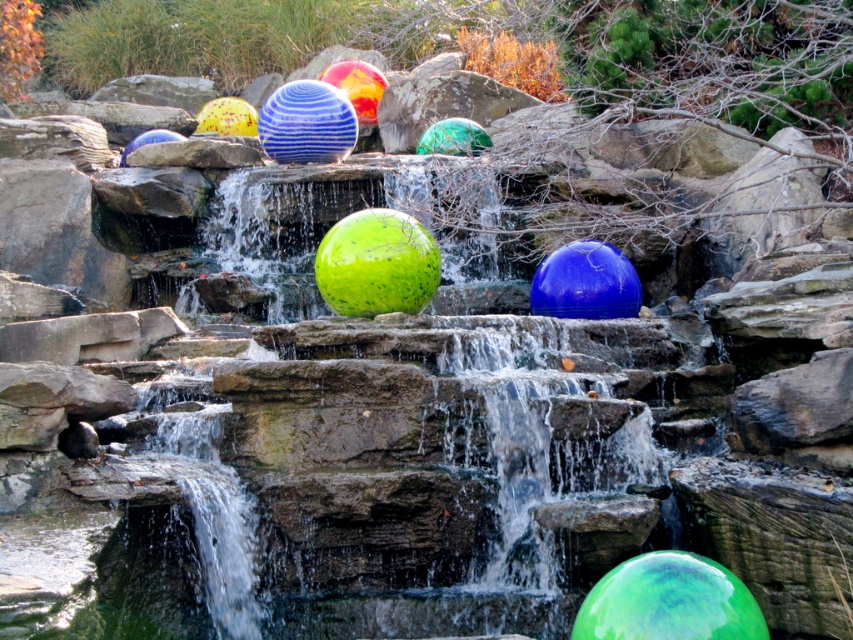
You are designing a garden layout and want to place a new decorative item between the glossy blue sphere at center and the yellow matte beach ball at upper left. Which object should you position closer to the ground to maintain visual balance?

The glossy blue sphere at center is shorter than the yellow matte beach ball at upper left, so to maintain visual balance, position the glossy blue sphere at center closer to the ground and the yellow matte beach ball at upper left higher up.

You are designing a garden layout and need to place a tall plant pot between the green speckled sphere at center and the yellow matte beach ball at upper left. Which object should the plant pot be placed closer to based on their heights?

The green speckled sphere at center is shorter than the yellow matte beach ball at upper left, so the plant pot should be placed closer to the yellow matte beach ball at upper left to maintain visual balance between the two objects.

Please provide the 2D coordinates of the glossy blue sphere at center in the image. The coordinates should be in the format of a point with two decimal places, such as 0.5,0.5.

The glossy blue sphere at center is located at point (585, 282).